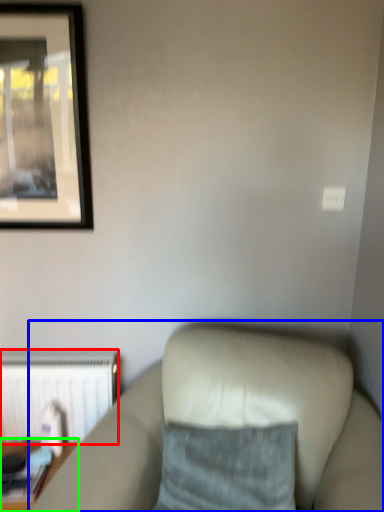
Question: Based on their relative distances, which object is farther from radiator (highlighted by a red box)? Choose from studio couch (highlighted by a blue box) and table (highlighted by a green box).

Choices:
 (A) studio couch
 (B) table

Answer: (A)